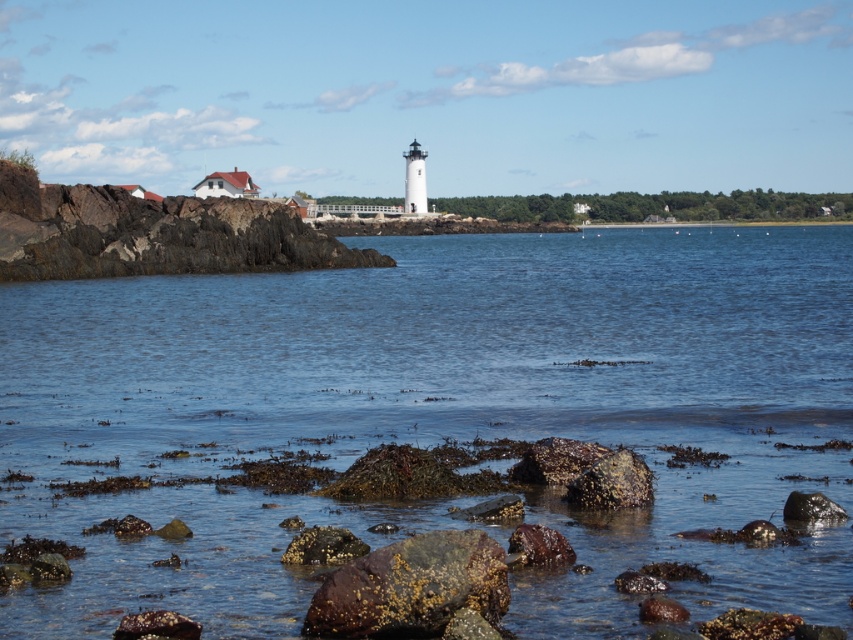
Who is positioned more to the right, rusty stone rocks at left or smooth gray rock at lower right?

smooth gray rock at lower right is more to the right.

Does rusty stone rocks at left appear on the left side of smooth gray rock at lower right?

Correct, you'll find rusty stone rocks at left to the left of smooth gray rock at lower right.

Measure the distance between rusty stone rocks at left and camera.

The distance of rusty stone rocks at left from camera is 309.53 feet.

Locate an element on the screen. rusty stone rocks at left is located at coordinates (152, 234).

Who is higher up, clear water at center or rusty stone rocks at left?

Positioned higher is rusty stone rocks at left.

Who is positioned more to the left, clear water at center or rusty stone rocks at left?

rusty stone rocks at left is more to the left.

Where is `clear water at center`? The width and height of the screenshot is (853, 640). clear water at center is located at coordinates (436, 413).

Can you confirm if rusty metallic rock at center is bigger than smooth gray rock at lower right?

Yes.

Does rusty metallic rock at center appear under smooth gray rock at lower right?

Yes, rusty metallic rock at center is below smooth gray rock at lower right.

Does point (395, 579) lie in front of point (804, 496)?

Yes, it is in front of point (804, 496).

The width and height of the screenshot is (853, 640). I want to click on rusty metallic rock at center, so click(410, 588).